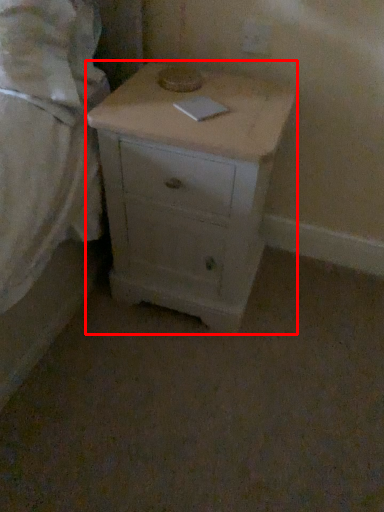
Question: Observing the image, what is the correct spatial positioning of chest of drawers (annotated by the red box) in reference to bed?

Choices:
 (A) left
 (B) right

Answer: (B)